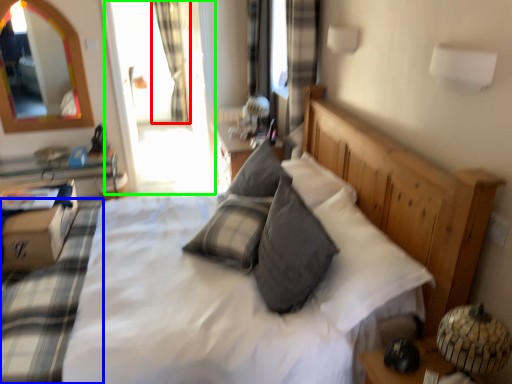
Question: Which object is the closest to the curtain (highlighted by a red box)? Choose among these: bedding (highlighted by a blue box) or glass door (highlighted by a green box).

Choices:
 (A) bedding
 (B) glass door

Answer: (B)